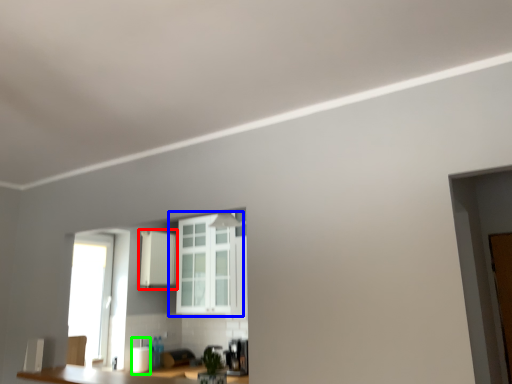
Question: Which object is the farthest from cabinetry (highlighted by a red box)? Choose among these: window (highlighted by a blue box) or appliance (highlighted by a green box).

Choices:
 (A) window
 (B) appliance

Answer: (B)